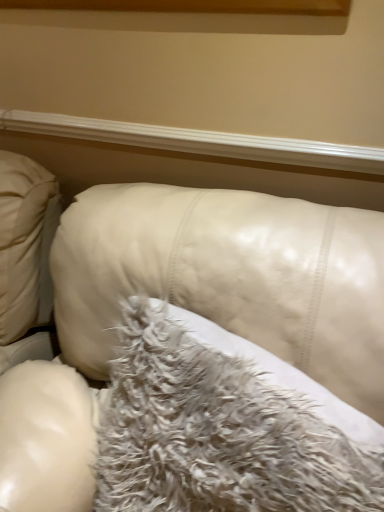
Question: From the image's perspective, is fuzzy white pillow at center beneath white leather couch at center?

Choices:
 (A) no
 (B) yes

Answer: (A)

Question: Is white leather couch at center at the back of fuzzy white pillow at center?

Choices:
 (A) no
 (B) yes

Answer: (B)

Question: From a real-world perspective, does fuzzy white pillow at center sit lower than white leather couch at center?

Choices:
 (A) yes
 (B) no

Answer: (B)

Question: Considering the relative positions of fuzzy white pillow at center and white leather couch at center in the image provided, is fuzzy white pillow at center in front of white leather couch at center?

Choices:
 (A) no
 (B) yes

Answer: (A)

Question: Considering the relative sizes of fuzzy white pillow at center and white leather couch at center in the image provided, is fuzzy white pillow at center taller than white leather couch at center?

Choices:
 (A) yes
 (B) no

Answer: (B)

Question: Can you confirm if fuzzy white pillow at center is shorter than white leather couch at center?

Choices:
 (A) no
 (B) yes

Answer: (B)

Question: Is white glossy wood at upper center far from fuzzy white pillow at center?

Choices:
 (A) no
 (B) yes

Answer: (A)

Question: Can you confirm if white glossy wood at upper center is positioned to the left of fuzzy white pillow at center?

Choices:
 (A) no
 (B) yes

Answer: (B)

Question: Is white glossy wood at upper center positioned behind fuzzy white pillow at center?

Choices:
 (A) yes
 (B) no

Answer: (A)

Question: Can you confirm if white glossy wood at upper center is thinner than fuzzy white pillow at center?

Choices:
 (A) no
 (B) yes

Answer: (B)

Question: From a real-world perspective, is white glossy wood at upper center physically above fuzzy white pillow at center?

Choices:
 (A) yes
 (B) no

Answer: (A)

Question: From a real-world perspective, is white glossy wood at upper center under fuzzy white pillow at center?

Choices:
 (A) no
 (B) yes

Answer: (A)

Question: Considering the relative sizes of white leather couch at center and fuzzy white pillow at center in the image provided, is white leather couch at center wider than fuzzy white pillow at center?

Choices:
 (A) yes
 (B) no

Answer: (A)